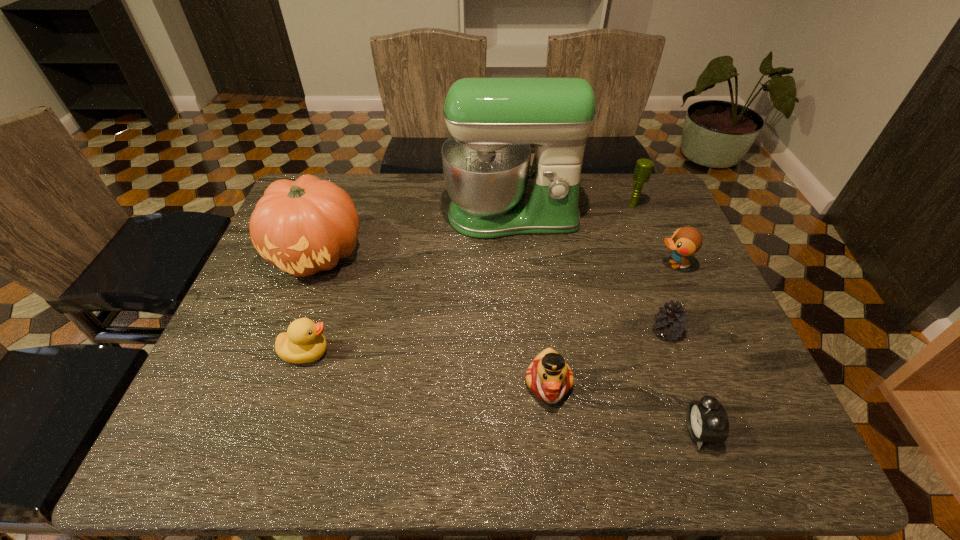
You are a GUI agent. You are given a task and a screenshot of the screen. Output one action in this format:
    pyautogui.click(x=<x>, y=<y>)
    Task: Click on the free spot between the mixer and the pinecone
    
    Given the screenshot: What is the action you would take?
    pyautogui.click(x=589, y=274)

Find the location of a particular element. Image resolution: width=960 pixels, height=540 pixels. vacant area that lies between the second duck from left to right and the mixer is located at coordinates (530, 300).

Identify the location of unoccupied area between the farthest duck and the leftmost duck. This screenshot has width=960, height=540. (490, 308).

Image resolution: width=960 pixels, height=540 pixels. What are the coordinates of `free space between the second duck from right to left and the microphone` in the screenshot? It's located at (590, 294).

Find the location of a particular element. The width and height of the screenshot is (960, 540). object that ranks as the second closest to the pinecone is located at coordinates pyautogui.click(x=707, y=421).

The width and height of the screenshot is (960, 540). I want to click on object that stands as the third closest to the rightmost duck, so click(x=643, y=169).

Image resolution: width=960 pixels, height=540 pixels. Find the location of `the closest duck to the nearest object`. the closest duck to the nearest object is located at coordinates (549, 377).

The width and height of the screenshot is (960, 540). In order to click on duck that stands as the second closest to the farthest duck in this screenshot , I will do `click(303, 342)`.

Locate an element on the screen. The image size is (960, 540). vacant area in the image that satisfies the following two spatial constraints: 1. on the front side of the third tallest object; 2. at the beak of the leftmost duck is located at coordinates (691, 353).

Find the location of a particular element. free location that satisfies the following two spatial constraints: 1. on the front-facing side of the farthest duck; 2. on the front side of the pinecone is located at coordinates (702, 331).